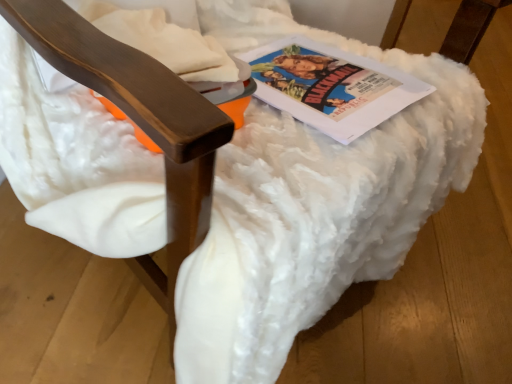
The width and height of the screenshot is (512, 384). Describe the element at coordinates (331, 86) in the screenshot. I see `matte paper magazine at center` at that location.

Measure the distance between point (372, 110) and camera.

They are 23.27 inches apart.

Identify the location of matte paper magazine at center. (331, 86).

At what (x,y) coordinates should I click in order to perform the action: click on matte paper magazine at center. Please return your answer as a coordinate pair (x, y). The height and width of the screenshot is (384, 512). Looking at the image, I should click on (331, 86).